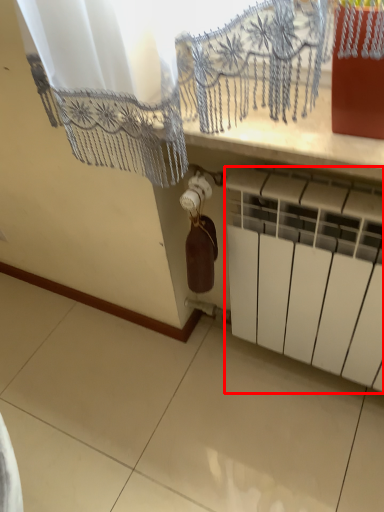
Question: From the image's perspective, considering the relative positions of radiator (annotated by the red box) and wine bottle in the image provided, where is radiator (annotated by the red box) located with respect to the staircase?

Choices:
 (A) above
 (B) below

Answer: (B)